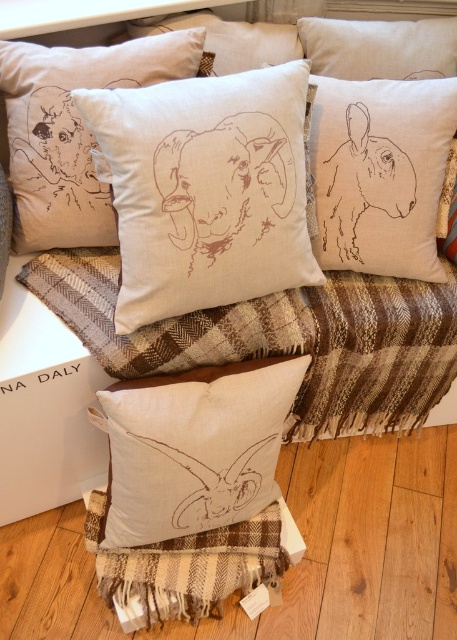
Question: Does beige linen rabbit at upper right lie in front of matte beige pillow with rabbit design at center?

Choices:
 (A) no
 (B) yes

Answer: (A)

Question: Does matte beige cushion at center appear on the left side of beige linen rabbit at upper right?

Choices:
 (A) no
 (B) yes

Answer: (B)

Question: Is matte beige cushion at center positioned in front of beige linen cushion at center?

Choices:
 (A) no
 (B) yes

Answer: (B)

Question: Which point appears closest to the camera in this image?

Choices:
 (A) (288, 77)
 (B) (233, 481)
 (C) (382, 52)

Answer: (A)

Question: Among these objects, which one is nearest to the camera?

Choices:
 (A) brown woven blanket at center
 (B) beige linen rabbit at upper right

Answer: (A)

Question: Which object is the farthest from the beige linen cushion at center?

Choices:
 (A) natural linen cushion at upper right
 (B) matte beige pillow with rabbit design at center
 (C) brown plaid blanket at lower center
 (D) beige linen cushion with rabbit drawing at center

Answer: (C)